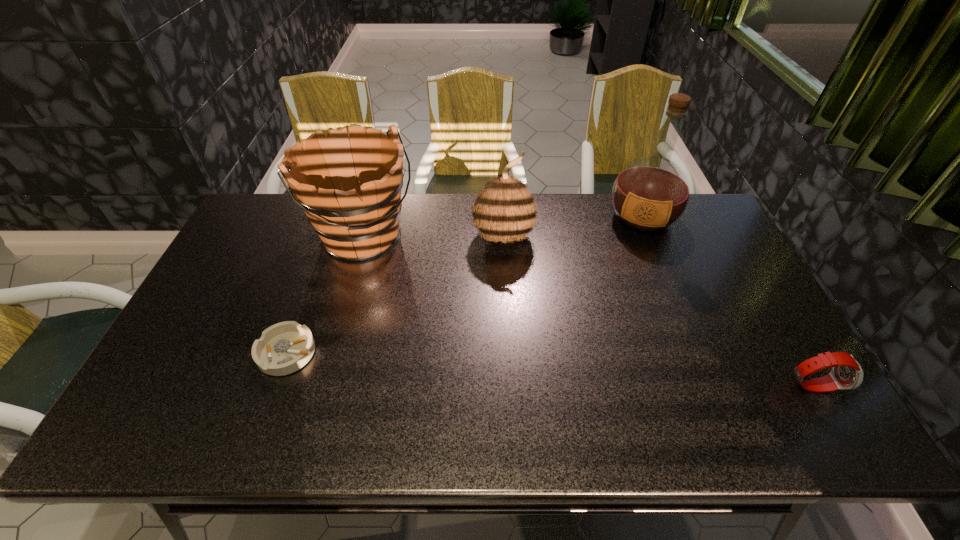
Locate which object ranks third in proximity to the second shortest object. Please provide its 2D coordinates. Your answer should be formatted as a tuple, i.e. [(x, y)], where the tuple contains the x and y coordinates of a point satisfying the conditions above.

[(349, 187)]

This screenshot has width=960, height=540. I want to click on vacant space that satisfies the following two spatial constraints: 1. on the front side of the second object from right to left; 2. on the face of the rightmost object, so click(710, 385).

Identify the location of vacant space that satisfies the following two spatial constraints: 1. on the back side of the third object from left to right; 2. on the right side of the shortest object. Image resolution: width=960 pixels, height=540 pixels. (329, 237).

Locate an element on the screen. The height and width of the screenshot is (540, 960). blank space that satisfies the following two spatial constraints: 1. on the back side of the coconut; 2. on the right side of the liquor is located at coordinates (502, 218).

The width and height of the screenshot is (960, 540). Find the location of `vacant region that satisfies the following two spatial constraints: 1. on the back side of the tallest object; 2. on the right side of the coconut`. vacant region that satisfies the following two spatial constraints: 1. on the back side of the tallest object; 2. on the right side of the coconut is located at coordinates tap(502, 218).

The width and height of the screenshot is (960, 540). Find the location of `vacant area that satisfies the following two spatial constraints: 1. on the front side of the liquor; 2. on the face of the rightmost object`. vacant area that satisfies the following two spatial constraints: 1. on the front side of the liquor; 2. on the face of the rightmost object is located at coordinates (710, 385).

Locate an element on the screen. The width and height of the screenshot is (960, 540). free space in the image that satisfies the following two spatial constraints: 1. on the back side of the second object from right to left; 2. on the right side of the third object from right to left is located at coordinates (502, 218).